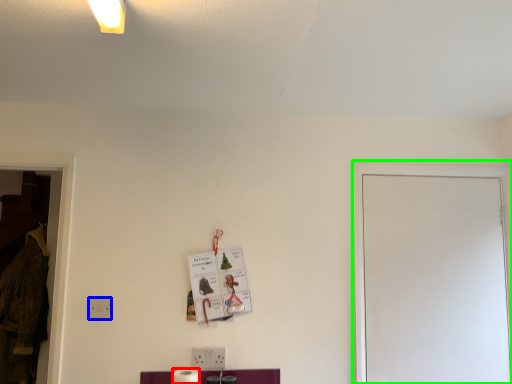
Question: Considering the real-world distances, which object is farthest from toilet paper (highlighted by a red box)? electric outlet (highlighted by a blue box) or glass door (highlighted by a green box)?

Choices:
 (A) electric outlet
 (B) glass door

Answer: (B)